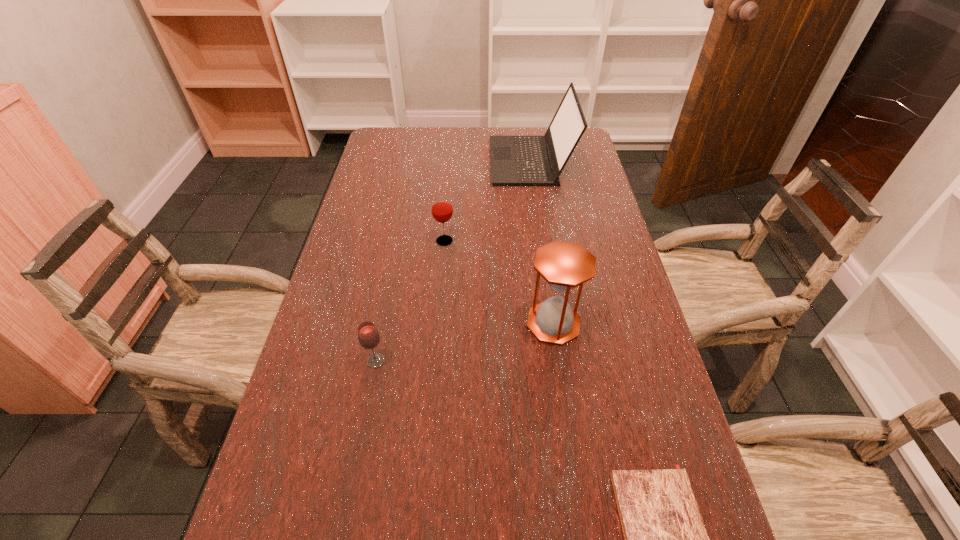
The image size is (960, 540). In order to click on laptop in this screenshot , I will do `click(515, 160)`.

You are a GUI agent. You are given a task and a screenshot of the screen. Output one action in this format:
    pyautogui.click(x=<x>, y=<y>)
    Task: Click on the third farthest object
    The width and height of the screenshot is (960, 540).
    Given the screenshot: What is the action you would take?
    pyautogui.click(x=564, y=265)

In order to click on the taller glass drink container in this screenshot , I will do `click(441, 206)`.

The height and width of the screenshot is (540, 960). Identify the location of the right glass drink container. (441, 206).

Identify the location of the nearer glass drink container. (369, 338).

This screenshot has height=540, width=960. I want to click on the fourth farthest object, so click(369, 338).

The width and height of the screenshot is (960, 540). Identify the location of free spot located 0.210m on the surface of the laptop. (432, 161).

You are a GUI agent. You are given a task and a screenshot of the screen. Output one action in this format:
    pyautogui.click(x=<x>, y=<y>)
    Task: Click on the free space located 0.220m on the surface of the laptop
    This screenshot has height=540, width=960.
    Given the screenshot: What is the action you would take?
    pyautogui.click(x=429, y=161)

I want to click on vacant space located 0.160m on the surface of the laptop, so click(x=445, y=161).

The height and width of the screenshot is (540, 960). Identify the location of vacant space located on the left of the third farthest object. (456, 323).